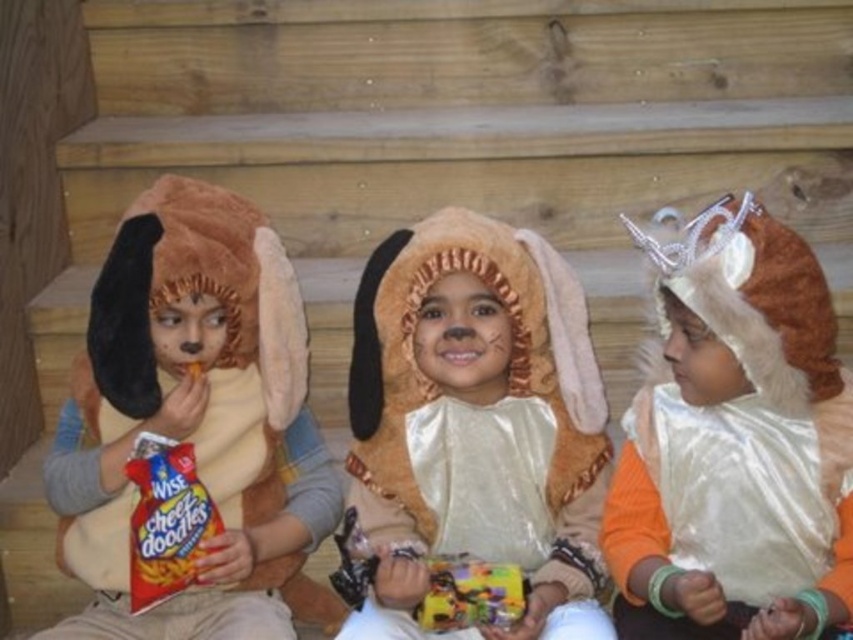
Question: Is fuzzy tan costume at center to the right of white shiny cape at center from the viewer's perspective?

Choices:
 (A) yes
 (B) no

Answer: (B)

Question: Which object is the closest to the white shiny cape at center?

Choices:
 (A) fuzzy beige costume at center
 (B) fuzzy tan costume at center

Answer: (A)

Question: Is matte brown plush dog at left to the right of white shiny cape at center from the viewer's perspective?

Choices:
 (A) yes
 (B) no

Answer: (B)

Question: Considering the real-world distances, which object is closest to the matte brown plush dog at left?

Choices:
 (A) white shiny cape at center
 (B) fuzzy beige costume at center

Answer: (B)

Question: Does fuzzy beige costume at center appear over matte brown plush dog at left?

Choices:
 (A) yes
 (B) no

Answer: (A)

Question: Estimate the real-world distances between objects in this image. Which object is farther from the fuzzy tan costume at center?

Choices:
 (A) matte brown plush dog at left
 (B) white shiny cape at center
 (C) fuzzy beige costume at center

Answer: (B)